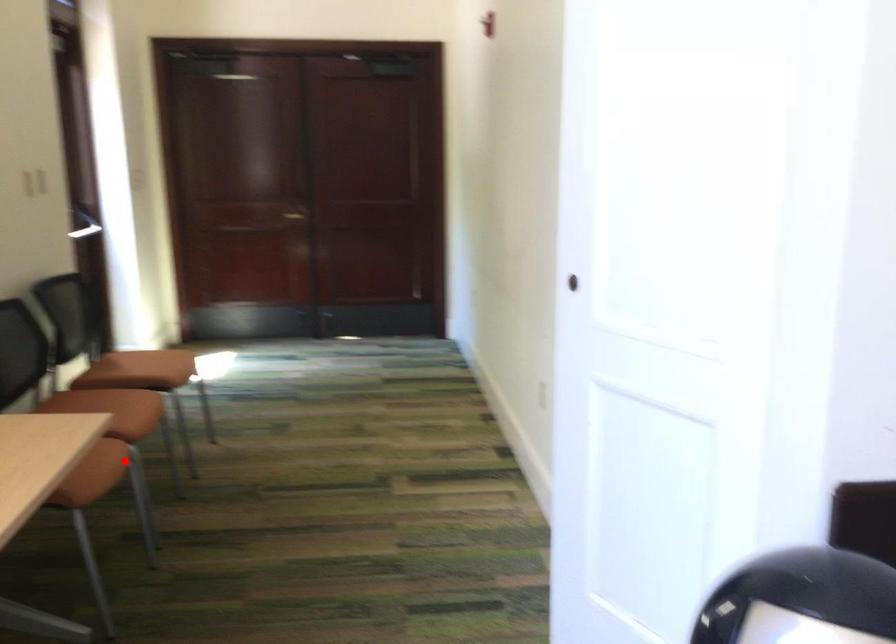
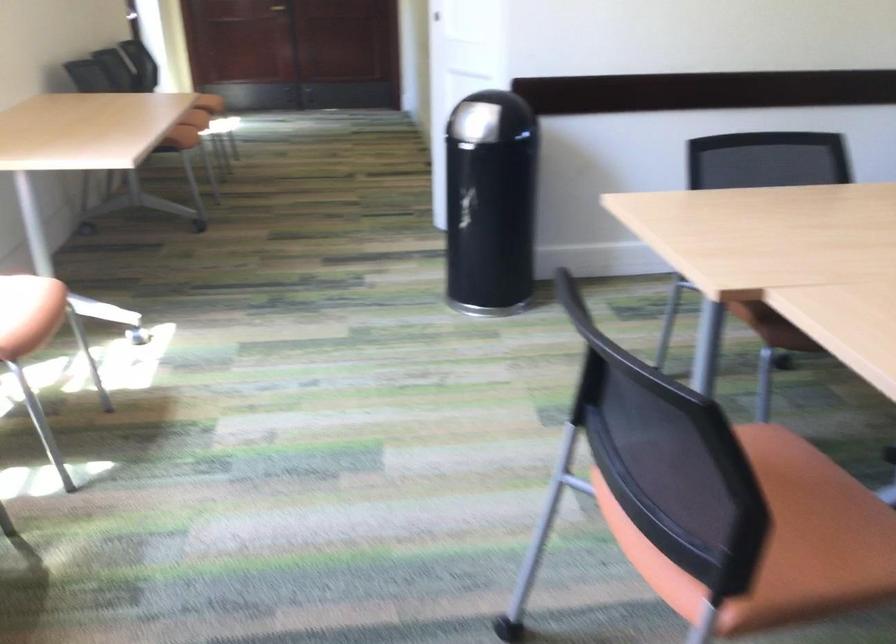
In the second image, find the point that corresponds to the highlighted location in the first image.

(192, 124)